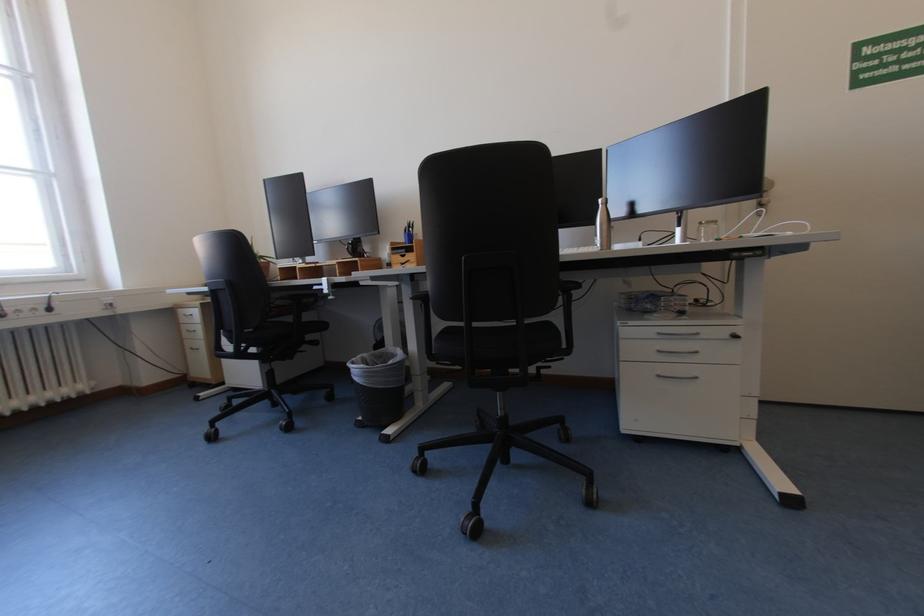
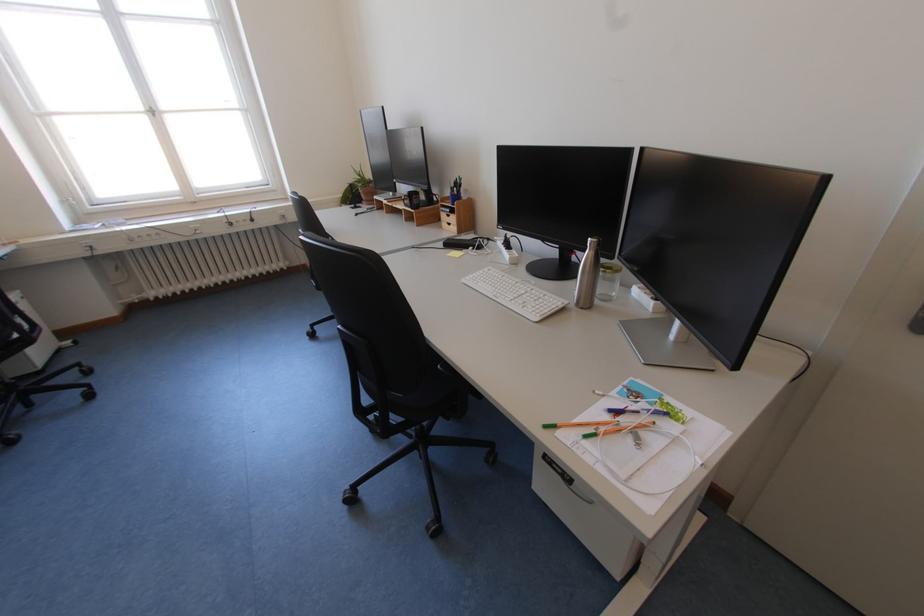
Locate, in the second image, the point that corresponds to [608,201] in the first image.

(599, 240)